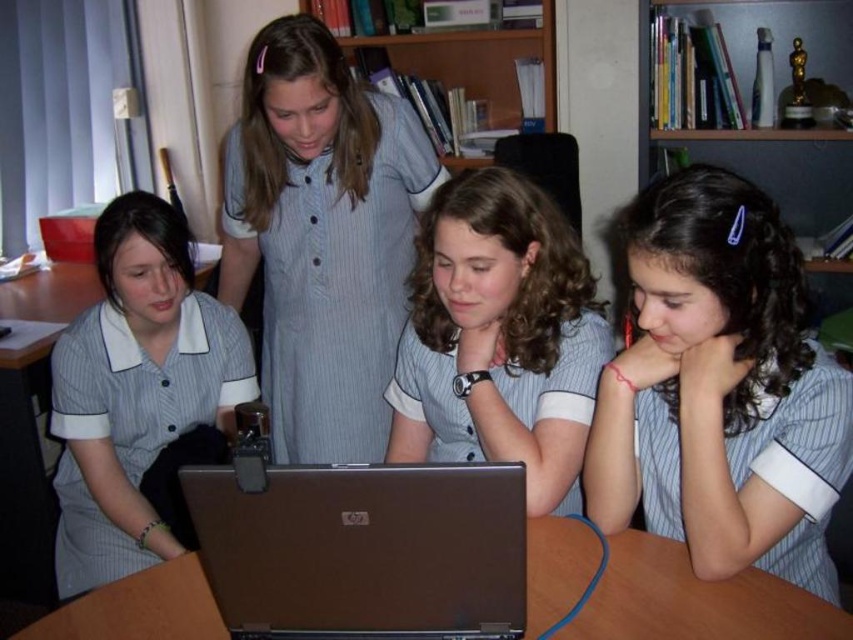
Question: Where is matte gray uniform at left located in relation to brown wooden table at center in the image?

Choices:
 (A) below
 (B) above

Answer: (B)

Question: Does hardcover books at upper center appear on the right side of wooden bookshelf at upper center?

Choices:
 (A) yes
 (B) no

Answer: (A)

Question: Which point appears closest to the camera in this image?

Choices:
 (A) (263, 138)
 (B) (657, 60)

Answer: (A)

Question: Which of these objects is positioned closest to the wooden bookshelf at upper center?

Choices:
 (A) matte gray uniform at left
 (B) silver metallic laptop at center
 (C) brown wooden table at center
 (D) hardcover books at upper center

Answer: (D)

Question: Is matte gray shirt at center positioned before hardcover books at upper center?

Choices:
 (A) no
 (B) yes

Answer: (B)

Question: Which object appears farthest from the camera in this image?

Choices:
 (A) matte gray uniform at center
 (B) silver metallic laptop at center
 (C) striped fabric dress at center
 (D) matte gray uniform at left

Answer: (D)